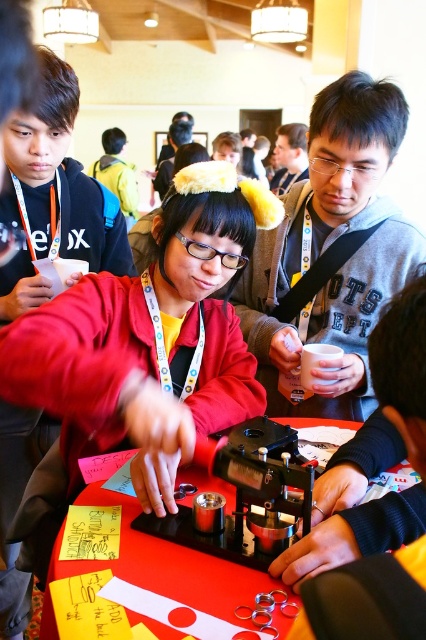
You are standing in the workshop and want to move from point (333, 124) to point (48, 593). Which direction should you move to get closer to your destination?

You should move towards the lower right direction because point (48, 593) is located lower and to the right compared to point (333, 124).

You are standing at the back of the room and want to reach the red plastic table at center. Is the matte gray hoodie at center blocking your path?

The red plastic table at center is behind the matte gray hoodie at center, so yes, the matte gray hoodie at center is blocking your path.

You are a participant in the workshop and need to place a 1.2 meter tall sculpture on the table. Can the red plastic table at center support the sculpture given the height of the matte gray hoodie at center?

The matte gray hoodie at center is much taller than the red plastic table at center. Since the sculpture is 1.2 meters tall, it would exceed the table height, making it unstable. Consider a taller table or shorter sculpture.